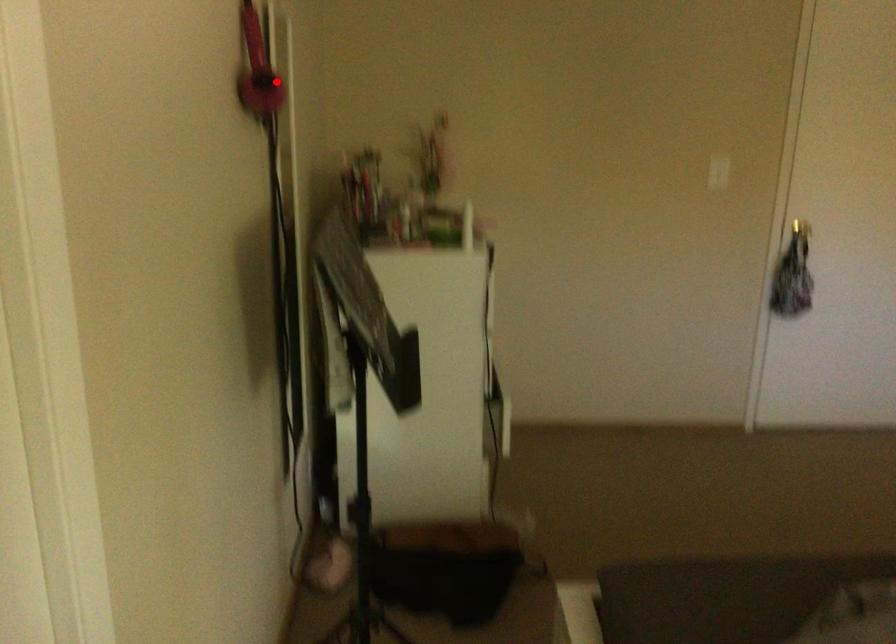
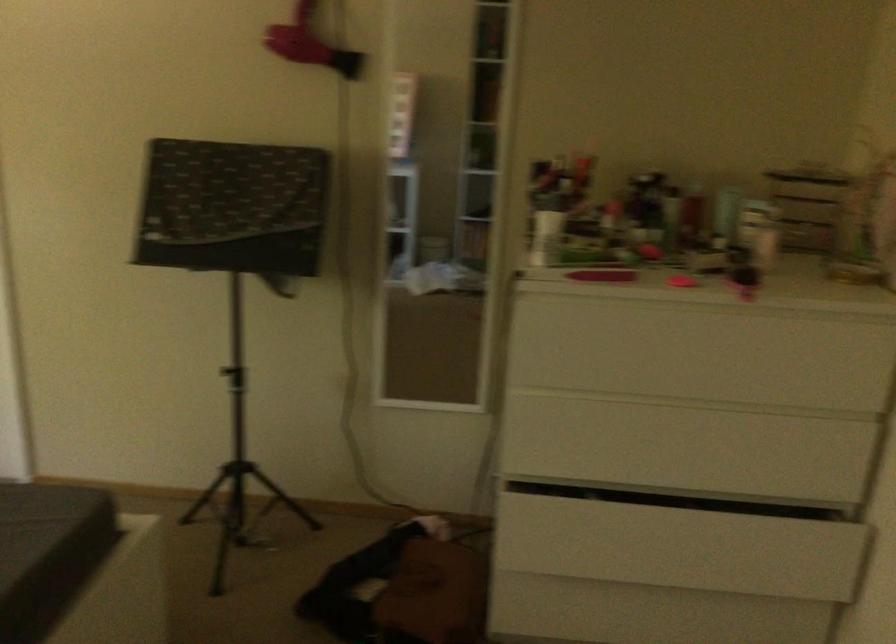
Question: A red point is marked in image1. In image2, is the corresponding 3D point closer to the camera or farther? Reply with the corresponding letter.

Choices:
 (A) The corresponding 3D point is closer.
 (B) The corresponding 3D point is farther.

Answer: (B)